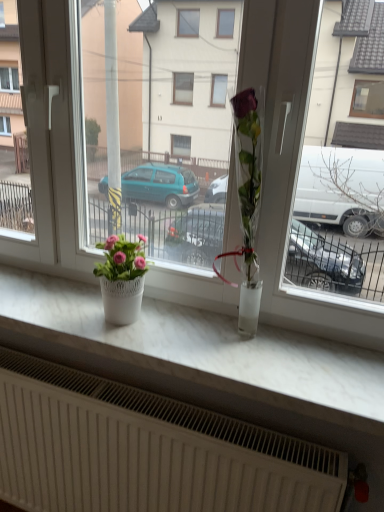
Measure the distance between point (141, 234) and camera.

A: They are 4.89 feet apart.

I want to click on white marble counter top at center, so click(x=211, y=349).

At what (x,y) coordinates should I click in order to perform the action: click on pink matte flower pot at left. Please return your answer as a coordinate pair (x, y). Looking at the image, I should click on (122, 278).

How distant is white textured radiator at lower center from transparent glass vase at center?

19.99 inches.

Which of these two, white textured radiator at lower center or transparent glass vase at center, stands taller?

transparent glass vase at center is taller.

From the image's perspective, between white textured radiator at lower center and transparent glass vase at center, who is located below?

white textured radiator at lower center appears lower in the image.

Where is `houseplant that appears above the white marble counter top at center (from the image's perspective)`? The height and width of the screenshot is (512, 384). houseplant that appears above the white marble counter top at center (from the image's perspective) is located at coordinates (122, 278).

Is white marble counter top at center at the right side of pink matte flower pot at left?

Yes.

From a real-world perspective, which object stands above the other?

pink matte flower pot at left, from a real-world perspective.

Measure the distance between white marble counter top at center and pink matte flower pot at left.

white marble counter top at center and pink matte flower pot at left are 24.93 centimeters apart.

How different are the orientations of white marble counter top at center and white textured radiator at lower center in degrees?

2.68 degrees.

Who is smaller, white marble counter top at center or white textured radiator at lower center?

With smaller size is white marble counter top at center.

Is white marble counter top at center situated inside white textured radiator at lower center or outside?

white marble counter top at center cannot be found inside white textured radiator at lower center.

Are pink matte flower pot at left and transparent glass vase at center located far from each other?

No.

The image size is (384, 512). I want to click on houseplant below the transparent glass vase at center (from a real-world perspective), so click(122, 278).

From the image's perspective, is pink matte flower pot at left under transparent glass vase at center?

Yes.

Does pink matte flower pot at left come in front of transparent glass vase at center?

No, pink matte flower pot at left is further to the viewer.

Is white marble counter top at center bigger or smaller than transparent glass vase at center?

In the image, white marble counter top at center appears to be smaller than transparent glass vase at center.

Does point (147, 338) appear closer or farther from the camera than point (361, 326)?

Point (147, 338).

Is white marble counter top at center directly adjacent to transparent glass vase at center?

No, white marble counter top at center is not making contact with transparent glass vase at center.

Is white marble counter top at center shorter than transparent glass vase at center?

Yes, white marble counter top at center is shorter than transparent glass vase at center.

Measure the distance between pink matte flower pot at left and white marble counter top at center.

pink matte flower pot at left is 24.93 centimeters away from white marble counter top at center.

Considering the relative sizes of pink matte flower pot at left and white marble counter top at center in the image provided, is pink matte flower pot at left thinner than white marble counter top at center?

Indeed, pink matte flower pot at left has a lesser width compared to white marble counter top at center.

From a real-world perspective, is pink matte flower pot at left positioned over white marble counter top at center based on gravity?

Indeed, from a real-world perspective, pink matte flower pot at left stands above white marble counter top at center.

Is pink matte flower pot at left with white marble counter top at center?

pink matte flower pot at left is not next to white marble counter top at center, and they're not touching.

Which is closer, (339, 316) or (134, 275)?

The point (339, 316) is more forward.

Which is more to the right, transparent glass vase at center or pink matte flower pot at left?

transparent glass vase at center is more to the right.

Does transparent glass vase at center contain pink matte flower pot at left?

No, pink matte flower pot at left is not inside transparent glass vase at center.

Which of these two, transparent glass vase at center or pink matte flower pot at left, is bigger?

Bigger between the two is transparent glass vase at center.

This screenshot has height=512, width=384. I want to click on window above the white textured radiator at lower center (from a real-world perspective), so click(x=292, y=170).

Locate an element on the screen. The image size is (384, 512). houseplant on the left of white marble counter top at center is located at coordinates (122, 278).

Which object lies nearer to the anchor point white textured radiator at lower center, pink matte flower pot at left or transparent glass vase at center?

pink matte flower pot at left is positioned closer to the anchor white textured radiator at lower center.

Based on their spatial positions, is white marble counter top at center or white textured radiator at lower center closer to pink matte flower pot at left?

The object closer to pink matte flower pot at left is white marble counter top at center.

When comparing their distances from white textured radiator at lower center, does transparent glass vase at center or white marble counter top at center seem further?

The object further to white textured radiator at lower center is transparent glass vase at center.

From the image, which object appears to be farther from pink matte flower pot at left, white textured radiator at lower center or white marble counter top at center?

Among the two, white textured radiator at lower center is located further to pink matte flower pot at left.

Considering their positions, is white textured radiator at lower center positioned closer to pink matte flower pot at left than transparent glass vase at center?

transparent glass vase at center is closer to pink matte flower pot at left.

Considering their positions, is white textured radiator at lower center positioned closer to white marble counter top at center than pink matte flower pot at left?

pink matte flower pot at left lies closer to white marble counter top at center than the other object.

From the image, which object appears to be nearer to transparent glass vase at center, white marble counter top at center or white textured radiator at lower center?

white marble counter top at center.

From the picture: Considering their positions, is pink matte flower pot at left positioned closer to transparent glass vase at center than white marble counter top at center?

white marble counter top at center is positioned closer to the anchor transparent glass vase at center.

You are a GUI agent. You are given a task and a screenshot of the screen. Output one action in this format:
    pyautogui.click(x=<x>, y=<y>)
    Task: Click on the counter top between transparent glass vase at center and white textured radiator at lower center in the vertical direction
    
    Given the screenshot: What is the action you would take?
    (x=211, y=349)

This screenshot has height=512, width=384. What are the coordinates of `counter top between pink matte flower pot at left and white textured radiator at lower center from top to bottom` in the screenshot? It's located at (211, 349).

This screenshot has height=512, width=384. I want to click on houseplant that lies between transparent glass vase at center and white textured radiator at lower center from top to bottom, so click(x=122, y=278).

I want to click on houseplant that lies between transparent glass vase at center and white marble counter top at center from top to bottom, so (122, 278).